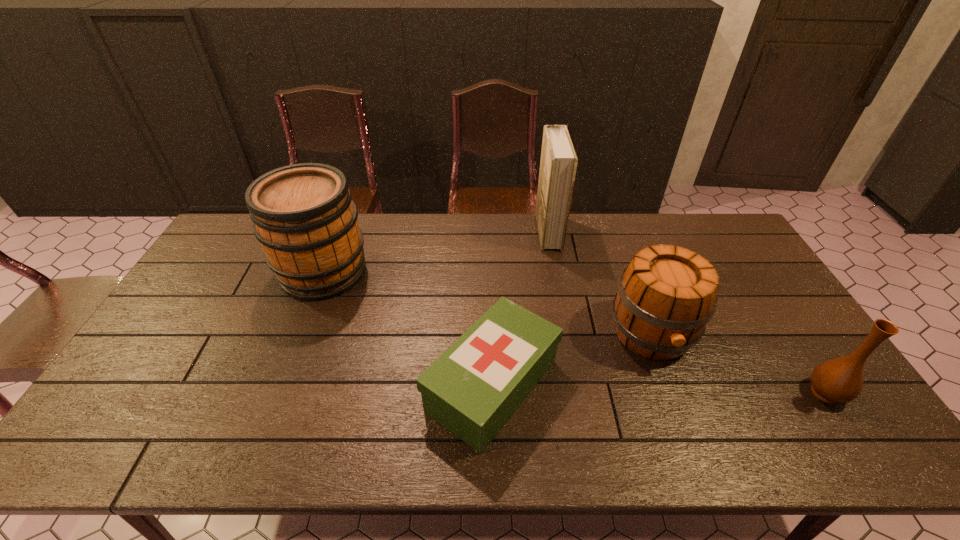
Locate an element on the screen. The image size is (960, 540). vacant position located 0.280m on the cover of the phonebook is located at coordinates (461, 232).

In order to click on vacant space positioned 0.380m on the right of the left cider in this screenshot , I will do coord(484,272).

Where is `vacant space situated on the left of the rightmost object`? vacant space situated on the left of the rightmost object is located at coordinates (743, 393).

This screenshot has width=960, height=540. I want to click on vacant area situated on the side of the right cider where the spigot is located, so click(697, 457).

This screenshot has width=960, height=540. Identify the location of vacant space located 0.260m on the back of the shortest object. (490, 269).

Where is `phonebook present at the far edge`? phonebook present at the far edge is located at coordinates (558, 164).

The width and height of the screenshot is (960, 540). I want to click on cider at the far edge, so point(303,215).

Identify the location of object that is at the near edge. The height and width of the screenshot is (540, 960). (473, 388).

Where is `object that is positioned at the right edge`? The height and width of the screenshot is (540, 960). object that is positioned at the right edge is located at coordinates (840, 380).

The width and height of the screenshot is (960, 540). I want to click on vacant space at the far edge of the desktop, so click(x=517, y=220).